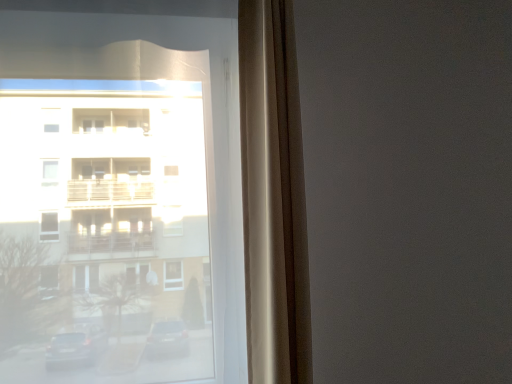
Find the location of a particular element. beige fabric curtain at center is located at coordinates (273, 196).

Describe the element at coordinates (273, 196) in the screenshot. Image resolution: width=512 pixels, height=384 pixels. I see `beige fabric curtain at center` at that location.

What is the approximate width of beige fabric curtain at center?

It is 9.32 inches.

The image size is (512, 384). In order to click on beige fabric curtain at center in this screenshot , I will do `click(273, 196)`.